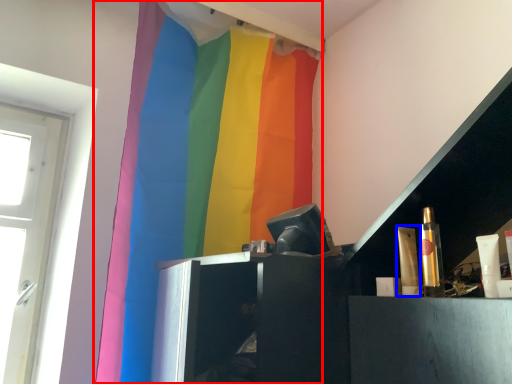
Question: Which object is further to the camera taking this photo, curtain (highlighted by a red box) or toiletry (highlighted by a blue box)?

Choices:
 (A) curtain
 (B) toiletry

Answer: (A)